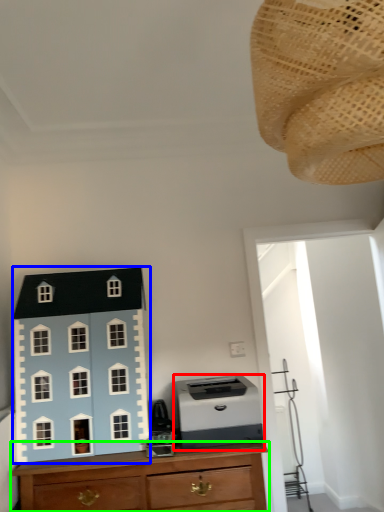
Question: Which is farther away from printer (highlighted by a red box)? toy (highlighted by a blue box) or chest of drawers (highlighted by a green box)?

Choices:
 (A) toy
 (B) chest of drawers

Answer: (A)